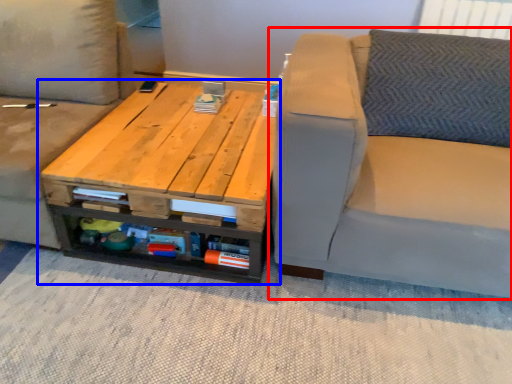
Question: Which point is further to the camera, studio couch (highlighted by a red box) or table (highlighted by a blue box)?

Choices:
 (A) studio couch
 (B) table

Answer: (B)